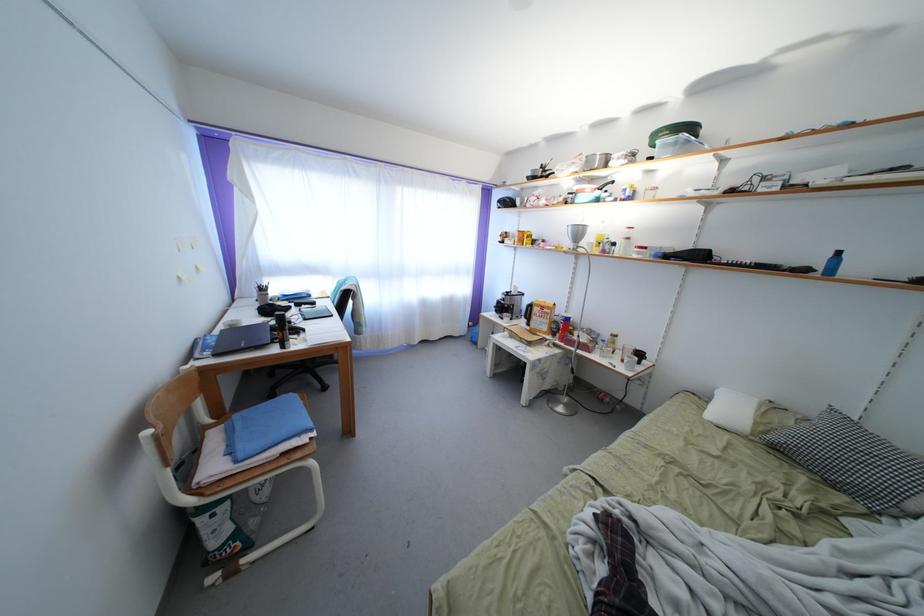
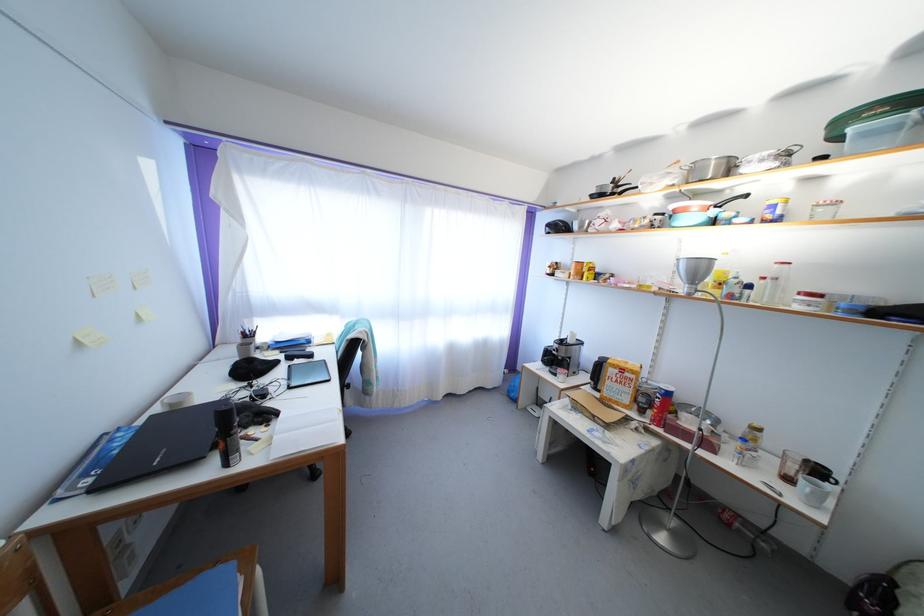
Question: How did the camera likely rotate?

Choices:
 (A) Left
 (B) Right
 (C) Up
 (D) Down

Answer: (C)